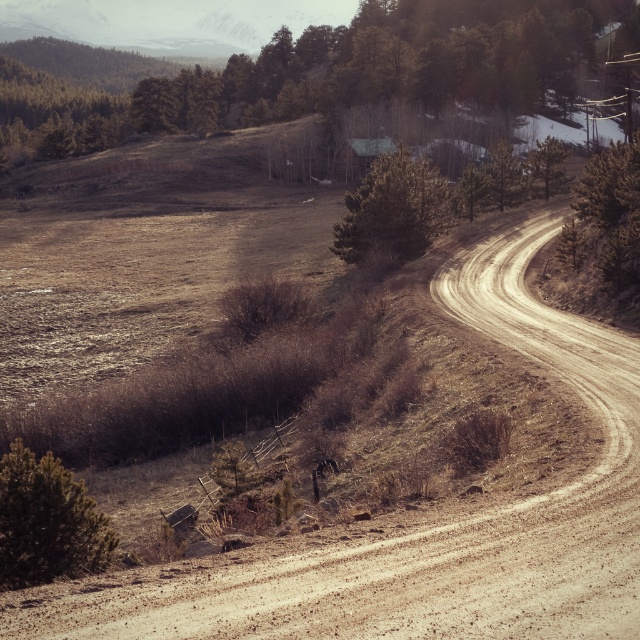
Which is more to the right, brown dirt track at center-right or green matte tree at center?

Positioned to the right is brown dirt track at center-right.

Which is in front, point (474, 259) or point (404, 204)?

Point (474, 259)

Is point (609, 456) farther from camera compared to point (410, 180)?

No, it is in front of (410, 180).

Where is `brown dirt track at center-right`? brown dirt track at center-right is located at coordinates (428, 518).

Can you confirm if green matte tree at upper center is shorter than green matte tree at lower left?

No, green matte tree at upper center is not shorter than green matte tree at lower left.

Can you confirm if green matte tree at upper center is positioned to the left of green matte tree at lower left?

Correct, you'll find green matte tree at upper center to the left of green matte tree at lower left.

Does point (358, 68) come farther from viewer compared to point (42, 509)?

Yes, point (358, 68) is farther from viewer.

Identify the location of green matte tree at upper center. (317, 74).

Based on the photo, is brown dirt track at center-right smaller than green matte tree at lower left?

Incorrect, brown dirt track at center-right is not smaller in size than green matte tree at lower left.

This screenshot has width=640, height=640. I want to click on brown dirt track at center-right, so click(x=428, y=518).

Find the location of a particular element. brown dirt track at center-right is located at coordinates (428, 518).